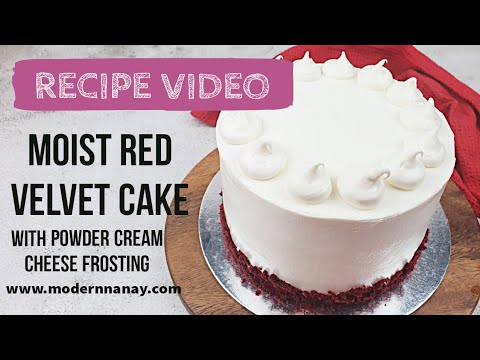
Find the location of `silver cake dish`. silver cake dish is located at coordinates (218, 261).